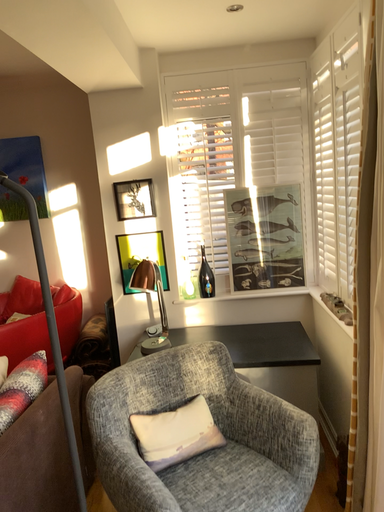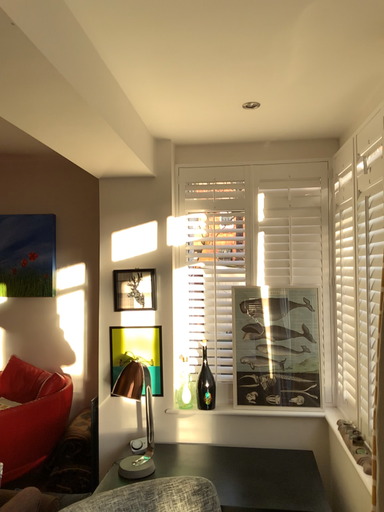
Question: How did the camera likely rotate when shooting the video?

Choices:
 (A) rotated upward
 (B) rotated downward

Answer: (A)